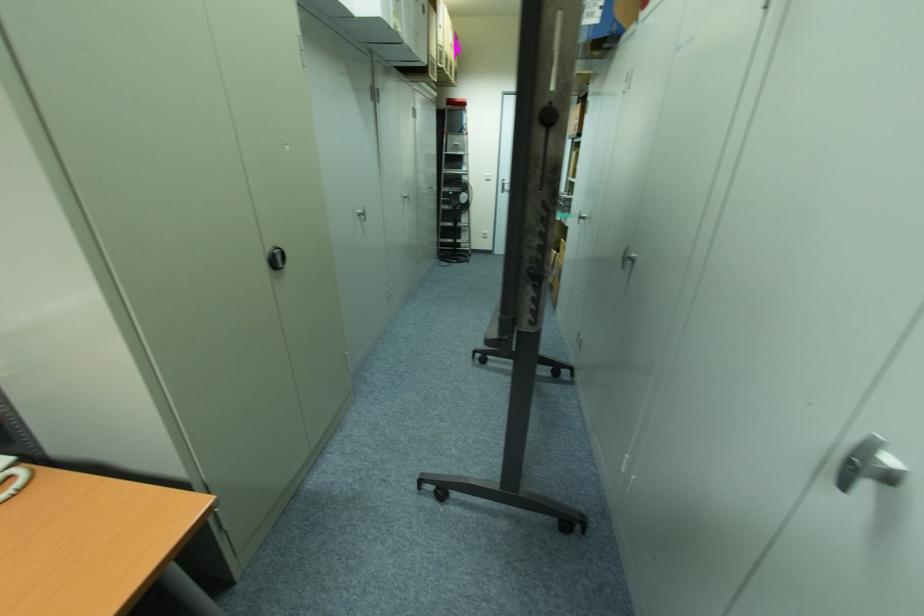
This screenshot has height=616, width=924. What do you see at coordinates (275, 257) in the screenshot? I see `the black adjustment knob` at bounding box center [275, 257].